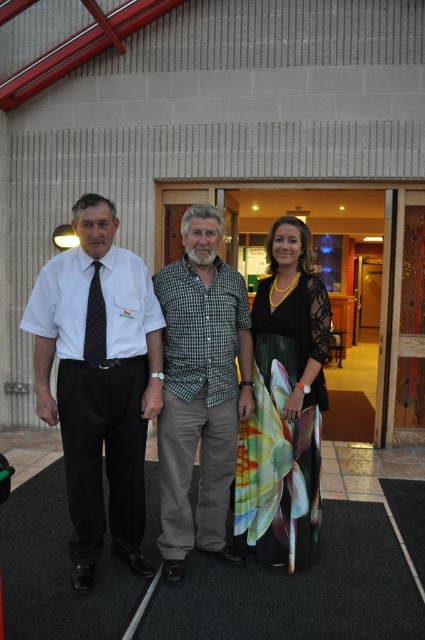
Question: Which point is farther to the camera?

Choices:
 (A) (260, 356)
 (B) (215, 531)
 (C) (88, 456)

Answer: (B)

Question: Which point is closer to the camera taking this photo?

Choices:
 (A) (246, 531)
 (B) (65, 356)
 (C) (232, 388)

Answer: (B)

Question: Is white shirt at left below floral silk dress at center?

Choices:
 (A) yes
 (B) no

Answer: (B)

Question: Is white shirt at left positioned in front of green checkered shirt at center?

Choices:
 (A) yes
 (B) no

Answer: (A)

Question: Considering the relative positions of white shirt at left and green checkered shirt at center in the image provided, where is white shirt at left located with respect to green checkered shirt at center?

Choices:
 (A) left
 (B) right

Answer: (A)

Question: Which of the following is the closest to the observer?

Choices:
 (A) white shirt at left
 (B) floral silk dress at center
 (C) green checkered shirt at center

Answer: (A)